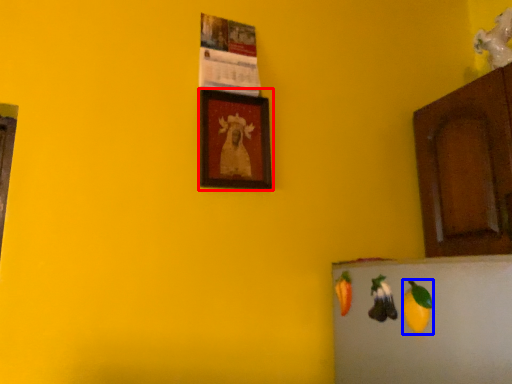
Question: Which of the following is the closest to the observer, picture frame (highlighted by a red box) or fruit (highlighted by a blue box)?

Choices:
 (A) picture frame
 (B) fruit

Answer: (B)